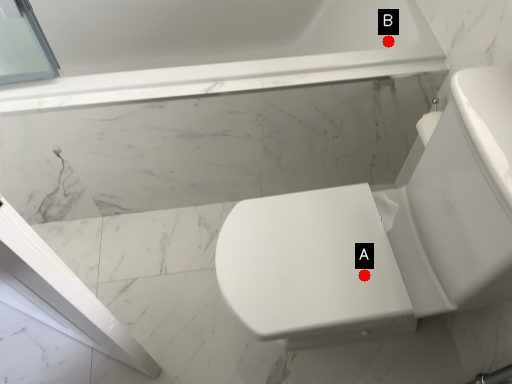
Question: Two points are circled on the image, labeled by A and B beside each circle. Which point is closer to the camera?

Choices:
 (A) A is closer
 (B) B is closer

Answer: (A)